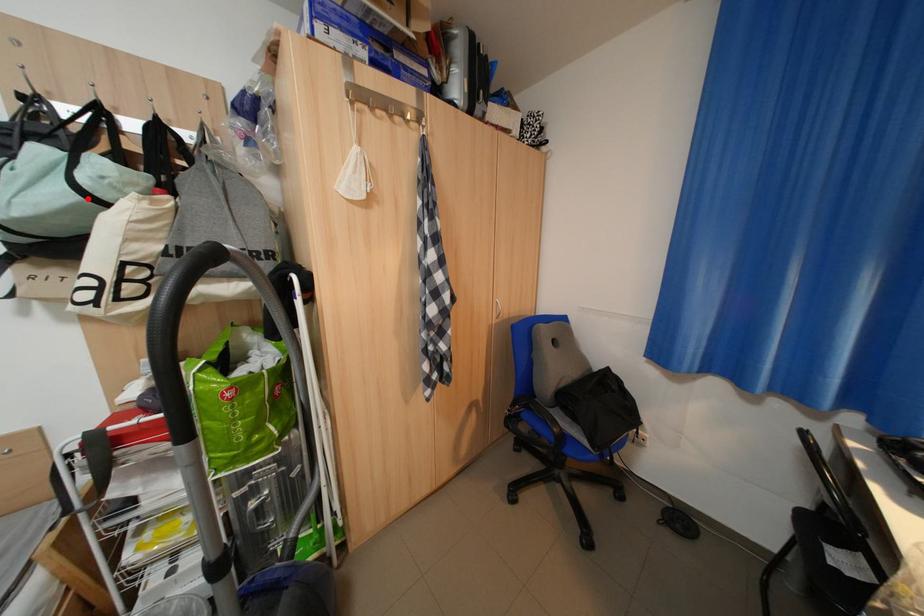
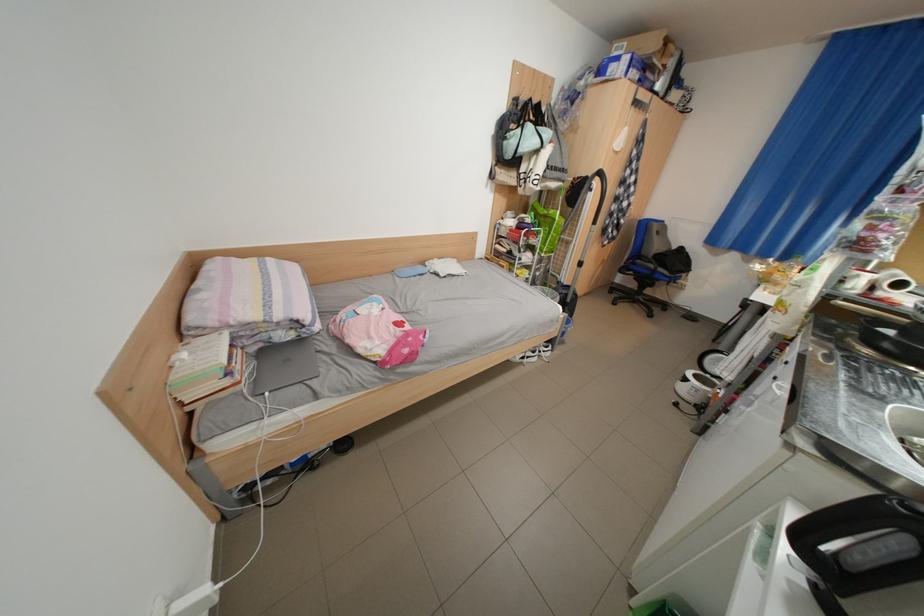
Where in the second image is the point corresponding to the highlighted location from the first image?

(552, 147)